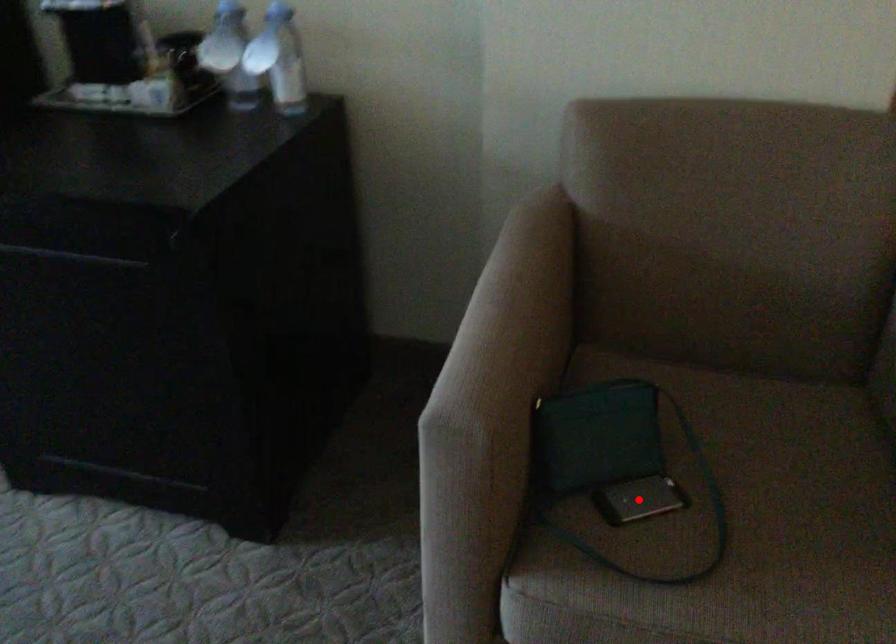
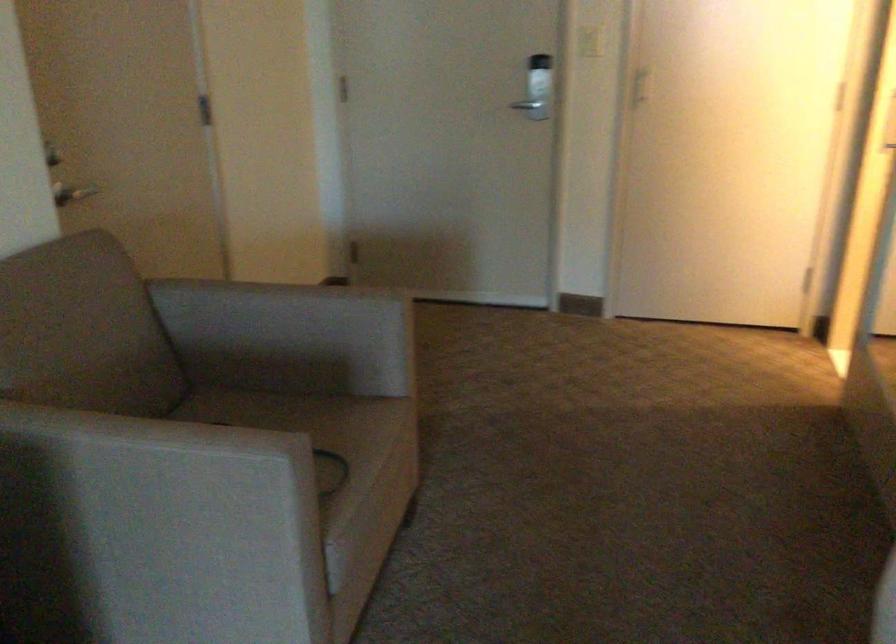
Question: I am providing you with two images of the same scene from different viewpoints. A red point is marked on the first image. Is the red point's position out of view in image 2?

Choices:
 (A) Yes
 (B) No

Answer: (A)